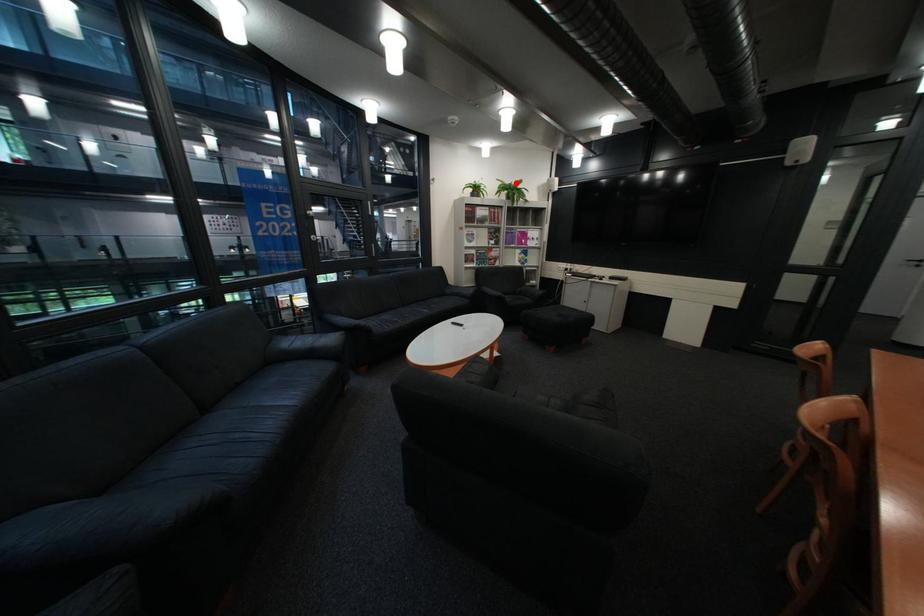
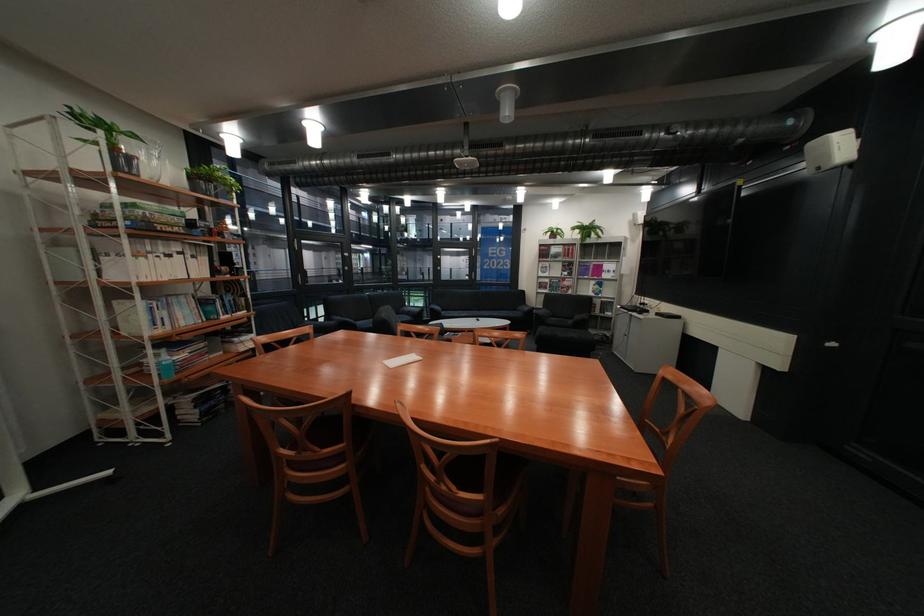
Where in the second image is the point corresponding to the highlighted location from the first image?

(594, 225)